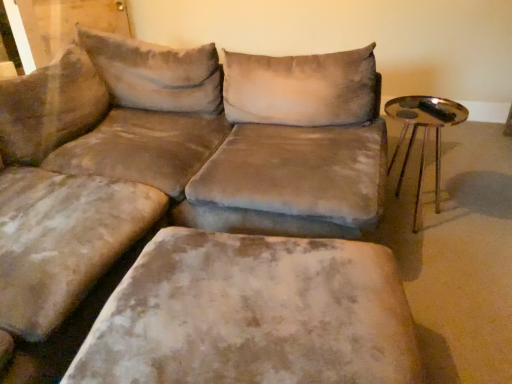
Consider the image. Measure the distance between point (121, 332) and camera.

The depth of point (121, 332) is 3.71 feet.

You are a GUI agent. You are given a task and a screenshot of the screen. Output one action in this format:
    pyautogui.click(x=<x>, y=<y>)
    Task: Click on the velvet beige ottoman at lower center
    The height and width of the screenshot is (384, 512).
    Given the screenshot: What is the action you would take?
    pyautogui.click(x=253, y=314)

What do you see at coordinates (253, 314) in the screenshot? I see `velvet beige ottoman at lower center` at bounding box center [253, 314].

What do you see at coordinates (423, 136) in the screenshot? Image resolution: width=512 pixels, height=384 pixels. I see `shiny metallic tray at right` at bounding box center [423, 136].

I want to click on shiny metallic tray at right, so click(x=423, y=136).

Where is `velvet beige ottoman at lower center`? Image resolution: width=512 pixels, height=384 pixels. velvet beige ottoman at lower center is located at coordinates (253, 314).

Considering the positions of objects shiny metallic tray at right and velvet beige ottoman at lower center in the image provided, who is more to the left, shiny metallic tray at right or velvet beige ottoman at lower center?

Positioned to the left is velvet beige ottoman at lower center.

Consider the image. Is shiny metallic tray at right further to camera compared to velvet beige ottoman at lower center?

Yes.

Does point (417, 229) lie behind point (241, 379)?

Yes, point (417, 229) is farther from viewer.

From the image's perspective, is shiny metallic tray at right above or below velvet beige ottoman at lower center?

shiny metallic tray at right is situated higher than velvet beige ottoman at lower center in the image.

From a real-world perspective, relative to velvet beige ottoman at lower center, is shiny metallic tray at right vertically above or below?

From a real-world perspective, shiny metallic tray at right is physically above velvet beige ottoman at lower center.

Considering the relative sizes of shiny metallic tray at right and velvet beige ottoman at lower center in the image provided, is shiny metallic tray at right wider than velvet beige ottoman at lower center?

In fact, shiny metallic tray at right might be narrower than velvet beige ottoman at lower center.

Can you confirm if shiny metallic tray at right is taller than velvet beige ottoman at lower center?

Yes, shiny metallic tray at right is taller than velvet beige ottoman at lower center.

Considering the sizes of shiny metallic tray at right and velvet beige ottoman at lower center in the image, is shiny metallic tray at right bigger or smaller than velvet beige ottoman at lower center?

In the image, shiny metallic tray at right appears to be smaller than velvet beige ottoman at lower center.

Would you say shiny metallic tray at right is inside or outside velvet beige ottoman at lower center?

The correct answer is: outside.

Is shiny metallic tray at right in contact with velvet beige ottoman at lower center?

No.

Does shiny metallic tray at right turn towards velvet beige ottoman at lower center?

Yes, shiny metallic tray at right is aimed at velvet beige ottoman at lower center.

What's the angular difference between shiny metallic tray at right and velvet beige ottoman at lower center's facing directions?

The facing directions of shiny metallic tray at right and velvet beige ottoman at lower center are 96.6 degrees apart.

The height and width of the screenshot is (384, 512). I want to click on table located above the velvet beige ottoman at lower center (from the image's perspective), so click(x=423, y=136).

Between velvet beige ottoman at lower center and shiny metallic tray at right, which one appears on the left side from the viewer's perspective?

Positioned to the left is velvet beige ottoman at lower center.

Considering their positions, is velvet beige ottoman at lower center located in front of or behind shiny metallic tray at right?

Visually, velvet beige ottoman at lower center is located in front of shiny metallic tray at right.

Is point (205, 372) less distant than point (438, 142)?

Yes, point (205, 372) is in front of point (438, 142).

From the image's perspective, is velvet beige ottoman at lower center above or below shiny metallic tray at right?

velvet beige ottoman at lower center is situated lower than shiny metallic tray at right in the image.

From a real-world perspective, is velvet beige ottoman at lower center physically located above or below shiny metallic tray at right?

Clearly, from a real-world perspective, velvet beige ottoman at lower center is below shiny metallic tray at right.

Between velvet beige ottoman at lower center and shiny metallic tray at right, which one has larger width?

velvet beige ottoman at lower center.

Consider the image. Can you confirm if velvet beige ottoman at lower center is shorter than shiny metallic tray at right?

Yes, velvet beige ottoman at lower center is shorter than shiny metallic tray at right.

In terms of size, does velvet beige ottoman at lower center appear bigger or smaller than shiny metallic tray at right?

velvet beige ottoman at lower center is bigger than shiny metallic tray at right.

Can we say velvet beige ottoman at lower center lies outside shiny metallic tray at right?

velvet beige ottoman at lower center is positioned outside shiny metallic tray at right.

Is velvet beige ottoman at lower center positioned far away from shiny metallic tray at right?

That's right, there is a large distance between velvet beige ottoman at lower center and shiny metallic tray at right.

Is velvet beige ottoman at lower center facing away from shiny metallic tray at right?

No, velvet beige ottoman at lower center's orientation is not away from shiny metallic tray at right.

Measure the distance from velvet beige ottoman at lower center to shiny metallic tray at right.

4.40 feet.

Identify the location of swivel chair that appears in front of the shiny metallic tray at right. (253, 314).

Find the location of a particular element. swivel chair below the shiny metallic tray at right (from a real-world perspective) is located at coordinates (253, 314).

Locate an element on the screen. The height and width of the screenshot is (384, 512). table behind the velvet beige ottoman at lower center is located at coordinates (423, 136).